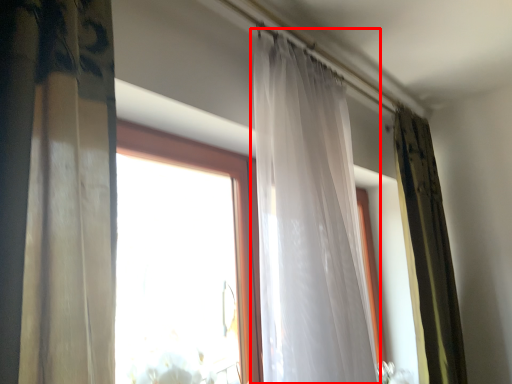
Question: Where is curtain (annotated by the red box) located in relation to curtain in the image?

Choices:
 (A) right
 (B) left

Answer: (B)